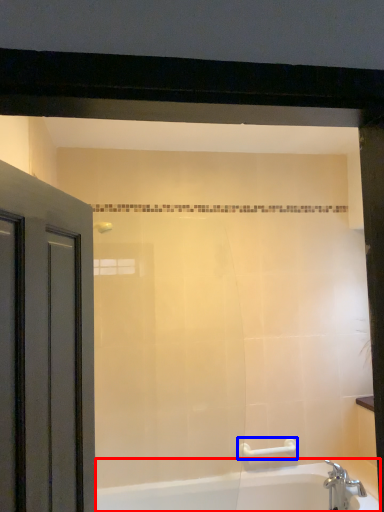
Question: Among these objects, which one is nearest to the camera, bathtub (highlighted by a red box) or towel bar (highlighted by a blue box)?

Choices:
 (A) bathtub
 (B) towel bar

Answer: (A)